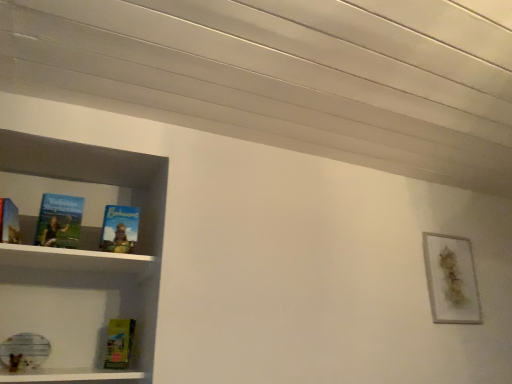
Describe the element at coordinates (119, 343) in the screenshot. Image resolution: width=512 pixels, height=384 pixels. I see `yellow matte paperback book at lower left` at that location.

Identify the location of matte blue book at left, which is the 1th book in left-to-right order. Image resolution: width=512 pixels, height=384 pixels. (59, 221).

Locate an element on the screen. Image resolution: width=512 pixels, height=384 pixels. gold textured frame at upper right is located at coordinates (451, 279).

You are a GUI agent. You are given a task and a screenshot of the screen. Output one action in this format:
    pyautogui.click(x=<x>, y=<y>)
    Task: Click on the yellow matte paperback book at lower left
    This screenshot has width=512, height=384.
    Given the screenshot: What is the action you would take?
    pyautogui.click(x=119, y=343)

Considering the positions of objects gold textured frame at upper right and blue matte book at center, the 2th book positioned from the left, in the image provided, who is in front, gold textured frame at upper right or blue matte book at center, the 2th book positioned from the left,?

Positioned in front is blue matte book at center, the 2th book positioned from the left.

Can you confirm if gold textured frame at upper right is smaller than blue matte book at center, the first book viewed from the right?

Actually, gold textured frame at upper right might be larger than blue matte book at center, the first book viewed from the right.

Is blue matte book at center, the first book viewed from the right, a part of gold textured frame at upper right?

No, gold textured frame at upper right does not contain blue matte book at center, the first book viewed from the right.

Considering the sizes of objects matte blue book at left, which is the 1th book in left-to-right order, and blue matte book at center, the 2th book positioned from the left, in the image provided, who is taller, matte blue book at left, which is the 1th book in left-to-right order, or blue matte book at center, the 2th book positioned from the left,?

Standing taller between the two is matte blue book at left, which is the 1th book in left-to-right order.

Is matte blue book at left, positioned as the 2th book in right-to-left order, turned away from blue matte book at center, the first book viewed from the right?

That's not correct — matte blue book at left, positioned as the 2th book in right-to-left order, is not looking away from blue matte book at center, the first book viewed from the right.

Looking at their sizes, would you say matte blue book at left, positioned as the 2th book in right-to-left order, is wider or thinner than blue matte book at center, the 2th book positioned from the left?

Considering their sizes, matte blue book at left, positioned as the 2th book in right-to-left order, looks broader than blue matte book at center, the 2th book positioned from the left.

From the image's perspective, which one is positioned higher, matte blue book at left, positioned as the 2th book in right-to-left order, or blue matte book at center, the first book viewed from the right?

matte blue book at left, positioned as the 2th book in right-to-left order, appears higher in the image.

Is yellow matte paperback book at lower left behind gold textured frame at upper right?

No.

Between point (128, 338) and point (437, 303), which one is positioned behind?

The point (437, 303) is farther.

Consider the image. Is gold textured frame at upper right at the back of yellow matte paperback book at lower left?

No, yellow matte paperback book at lower left is not facing the opposite direction of gold textured frame at upper right.

What's the angular difference between yellow matte paperback book at lower left and gold textured frame at upper right's facing directions?

34.3 degrees separate the facing orientations of yellow matte paperback book at lower left and gold textured frame at upper right.

Looking at this image, does matte blue book at left, which is the 1th book in left-to-right order, touch gold textured frame at upper right?

matte blue book at left, which is the 1th book in left-to-right order, and gold textured frame at upper right are clearly separated.

Considering the relative positions of matte blue book at left, which is the 1th book in left-to-right order, and gold textured frame at upper right in the image provided, is matte blue book at left, which is the 1th book in left-to-right order, to the left of gold textured frame at upper right from the viewer's perspective?

Correct, you'll find matte blue book at left, which is the 1th book in left-to-right order, to the left of gold textured frame at upper right.

Which is closer to the camera, (49,209) or (457,255)?

Point (49,209)

Is yellow matte paperback book at lower left inside the boundaries of matte blue book at left, which is the 1th book in left-to-right order, or outside?

yellow matte paperback book at lower left cannot be found inside matte blue book at left, which is the 1th book in left-to-right order.

Does point (115, 358) appear closer or farther from the camera than point (76, 228)?

Clearly, point (115, 358) is more distant from the camera than point (76, 228).

Is yellow matte paperback book at lower left turned away from matte blue book at left, which is the 1th book in left-to-right order?

No, matte blue book at left, which is the 1th book in left-to-right order, is not at the back of yellow matte paperback book at lower left.

Looking at this image, considering the relative sizes of yellow matte paperback book at lower left and matte blue book at left, positioned as the 2th book in right-to-left order, in the image provided, is yellow matte paperback book at lower left shorter than matte blue book at left, positioned as the 2th book in right-to-left order,?

Indeed, yellow matte paperback book at lower left has a lesser height compared to matte blue book at left, positioned as the 2th book in right-to-left order.

Is blue matte book at center, the 2th book positioned from the left, turned away from matte blue book at left, positioned as the 2th book in right-to-left order?

No, blue matte book at center, the 2th book positioned from the left, is not facing away from matte blue book at left, positioned as the 2th book in right-to-left order.

Between blue matte book at center, the first book viewed from the right, and matte blue book at left, positioned as the 2th book in right-to-left order, which one has smaller size?

blue matte book at center, the first book viewed from the right, is smaller.

In the scene shown: From the image's perspective, which one is positioned lower, blue matte book at center, the 2th book positioned from the left, or matte blue book at left, positioned as the 2th book in right-to-left order?

blue matte book at center, the 2th book positioned from the left, appears lower in the image.

Locate an element on the screen. The height and width of the screenshot is (384, 512). picture frame to the right of yellow matte paperback book at lower left is located at coordinates (451, 279).

Considering the sizes of gold textured frame at upper right and yellow matte paperback book at lower left in the image, is gold textured frame at upper right wider or thinner than yellow matte paperback book at lower left?

Clearly, gold textured frame at upper right has more width compared to yellow matte paperback book at lower left.

Which is nearer, (438, 300) or (115, 353)?

Point (438, 300) is farther from the camera than point (115, 353).

Would you say gold textured frame at upper right is a long distance from yellow matte paperback book at lower left?

Yes, gold textured frame at upper right and yellow matte paperback book at lower left are located far from each other.

Locate an element on the screen. This screenshot has height=384, width=512. picture frame below the blue matte book at center, the 2th book positioned from the left (from the image's perspective) is located at coordinates (451, 279).

Where is `book behind the matte blue book at left, which is the 1th book in left-to-right order`? book behind the matte blue book at left, which is the 1th book in left-to-right order is located at coordinates (119, 229).

From the picture: When comparing their distances from matte blue book at left, which is the 1th book in left-to-right order, does gold textured frame at upper right or yellow matte paperback book at lower left seem further?

gold textured frame at upper right is positioned further to the anchor matte blue book at left, which is the 1th book in left-to-right order.

Based on the photo, considering their positions, is gold textured frame at upper right positioned closer to yellow matte paperback book at lower left than matte blue book at left, which is the 1th book in left-to-right order?

matte blue book at left, which is the 1th book in left-to-right order, lies closer to yellow matte paperback book at lower left than the other object.

Considering their positions, is blue matte book at center, the first book viewed from the right, positioned closer to matte blue book at left, which is the 1th book in left-to-right order, than gold textured frame at upper right?

blue matte book at center, the first book viewed from the right, is positioned closer to the anchor matte blue book at left, which is the 1th book in left-to-right order.

Which object lies nearer to the anchor point matte blue book at left, which is the 1th book in left-to-right order, yellow matte paperback book at lower left or blue matte book at center, the first book viewed from the right?

blue matte book at center, the first book viewed from the right, is positioned closer to the anchor matte blue book at left, which is the 1th book in left-to-right order.

In the scene shown: Looking at the image, which one is located closer to yellow matte paperback book at lower left, matte blue book at left, positioned as the 2th book in right-to-left order, or gold textured frame at upper right?

matte blue book at left, positioned as the 2th book in right-to-left order, is closer to yellow matte paperback book at lower left.

Which object lies nearer to the anchor point matte blue book at left, positioned as the 2th book in right-to-left order, gold textured frame at upper right or blue matte book at center, the 2th book positioned from the left?

blue matte book at center, the 2th book positioned from the left, lies closer to matte blue book at left, positioned as the 2th book in right-to-left order, than the other object.

Based on their spatial positions, is matte blue book at left, positioned as the 2th book in right-to-left order, or blue matte book at center, the 2th book positioned from the left, further from gold textured frame at upper right?

matte blue book at left, positioned as the 2th book in right-to-left order, is further to gold textured frame at upper right.

Estimate the real-world distances between objects in this image. Which object is further from blue matte book at center, the 2th book positioned from the left, gold textured frame at upper right or matte blue book at left, positioned as the 2th book in right-to-left order?

gold textured frame at upper right lies further to blue matte book at center, the 2th book positioned from the left, than the other object.

The height and width of the screenshot is (384, 512). In order to click on book located between matte blue book at left, positioned as the 2th book in right-to-left order, and gold textured frame at upper right in the left-right direction in this screenshot , I will do (x=119, y=229).

Image resolution: width=512 pixels, height=384 pixels. Find the location of `paperback book between matte blue book at left, which is the 1th book in left-to-right order, and gold textured frame at upper right`. paperback book between matte blue book at left, which is the 1th book in left-to-right order, and gold textured frame at upper right is located at coordinates (119, 343).

Locate an element on the screen. Image resolution: width=512 pixels, height=384 pixels. book between matte blue book at left, positioned as the 2th book in right-to-left order, and yellow matte paperback book at lower left vertically is located at coordinates (119, 229).

You are a GUI agent. You are given a task and a screenshot of the screen. Output one action in this format:
    pyautogui.click(x=<x>, y=<y>)
    Task: Click on the book between yellow matte paperback book at lower left and gold textured frame at upper right in the horizontal direction
    The height and width of the screenshot is (384, 512).
    Given the screenshot: What is the action you would take?
    pyautogui.click(x=119, y=229)